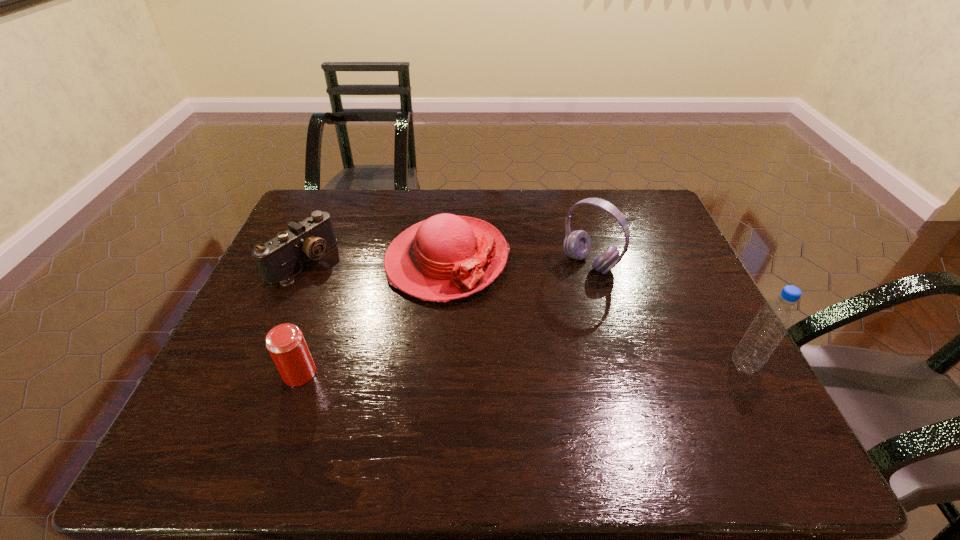
This screenshot has width=960, height=540. Identify the location of camera that is at the left edge. (278, 258).

Locate an element on the screen. Image resolution: width=960 pixels, height=540 pixels. object that is at the right edge is located at coordinates (773, 320).

Locate an element on the screen. object present at the near left corner is located at coordinates (285, 342).

This screenshot has width=960, height=540. What are the coordinates of `free space at the far edge` in the screenshot? It's located at (536, 203).

The height and width of the screenshot is (540, 960). Identify the location of vacant space at the left edge of the desktop. (318, 263).

The image size is (960, 540). I want to click on vacant space at the right edge, so click(x=710, y=349).

Find the location of a particular element. vacant position at the far left corner of the desktop is located at coordinates (300, 216).

This screenshot has height=540, width=960. I want to click on free spot at the far right corner of the desktop, so click(x=634, y=211).

Locate an element on the screen. free space between the water bottle and the third object from left to right is located at coordinates (595, 313).

The image size is (960, 540). In order to click on blank region between the camera and the third object from right to left in this screenshot , I will do `click(374, 261)`.